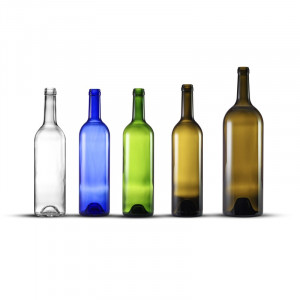
You are a GUI agent. You are given a task and a screenshot of the screen. Output one action in this format:
    pyautogui.click(x=<x>, y=<y>)
    Task: Click on the bottles
    The image size is (300, 300).
    Given the screenshot: What is the action you would take?
    pyautogui.click(x=49, y=169), pyautogui.click(x=89, y=167), pyautogui.click(x=140, y=165), pyautogui.click(x=182, y=159), pyautogui.click(x=238, y=159)